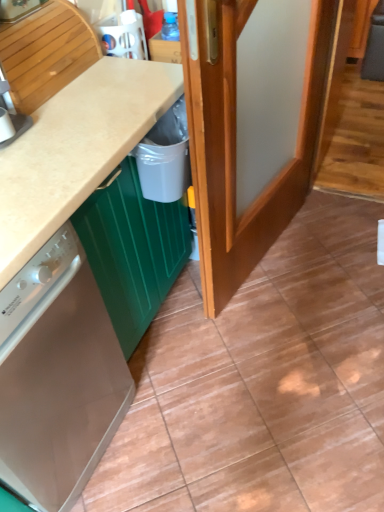
I want to click on vacant area on top of beige matte countertop at center (from a real-world perspective), so click(x=82, y=101).